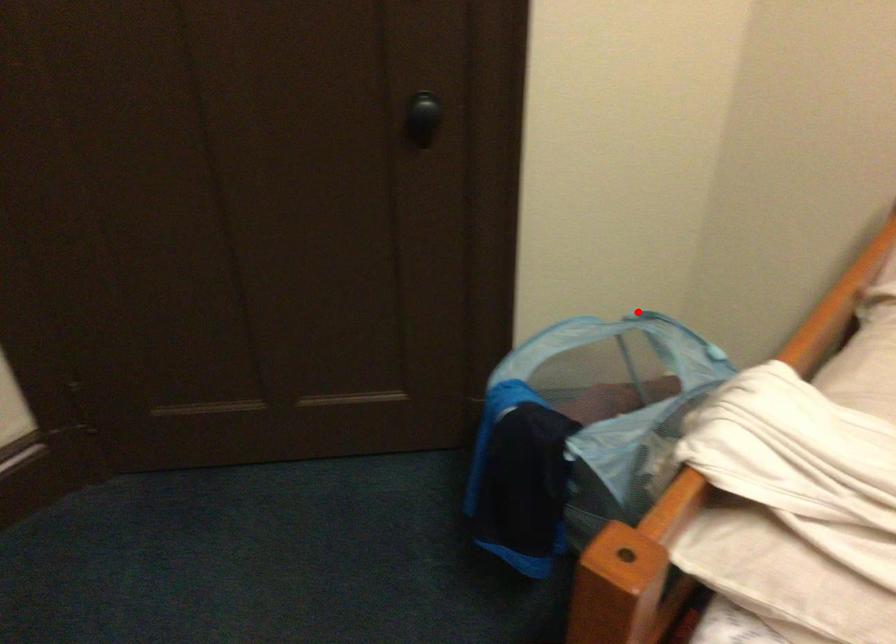
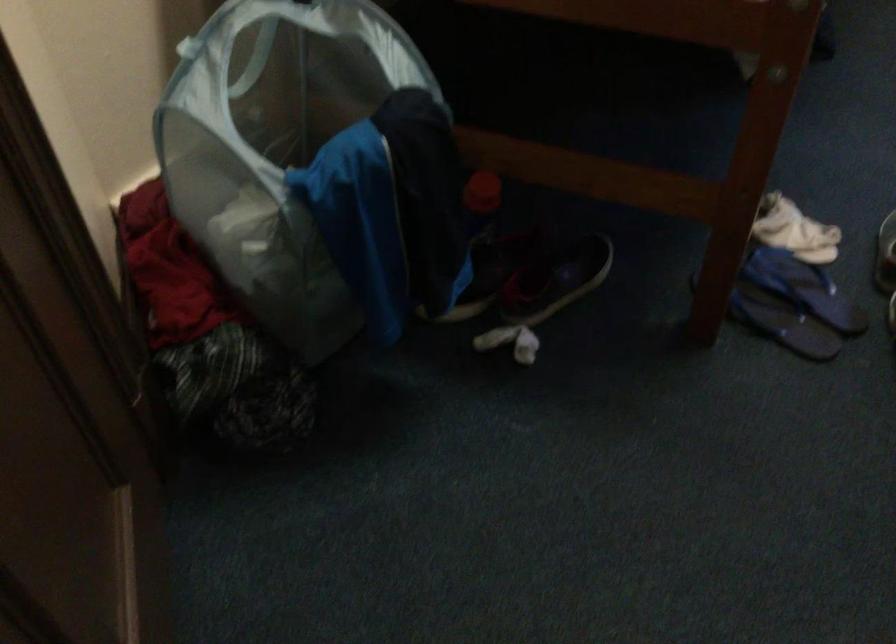
The point at the highlighted location is marked in the first image. Where is the corresponding point in the second image?

(186, 46)